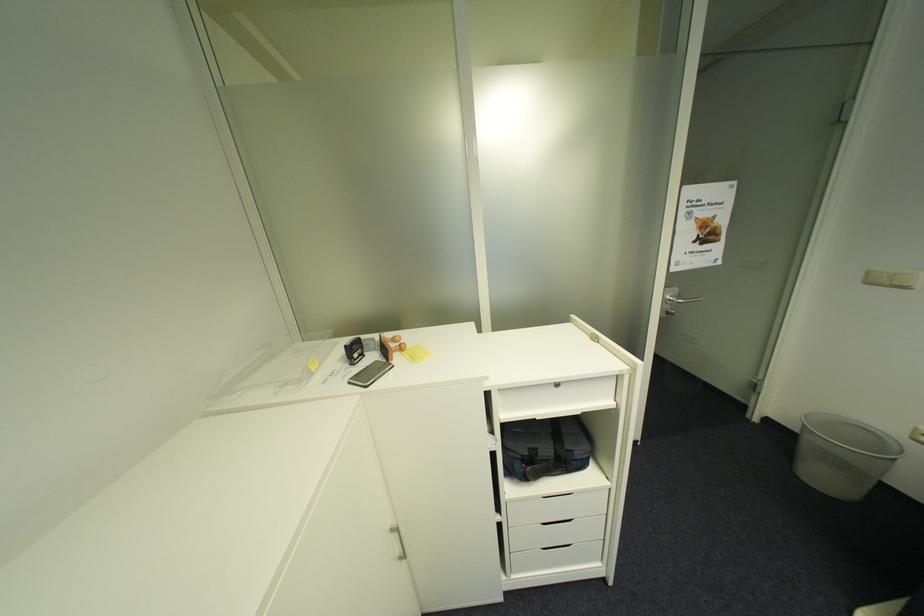
I want to click on black ink stamp, so click(x=354, y=350).